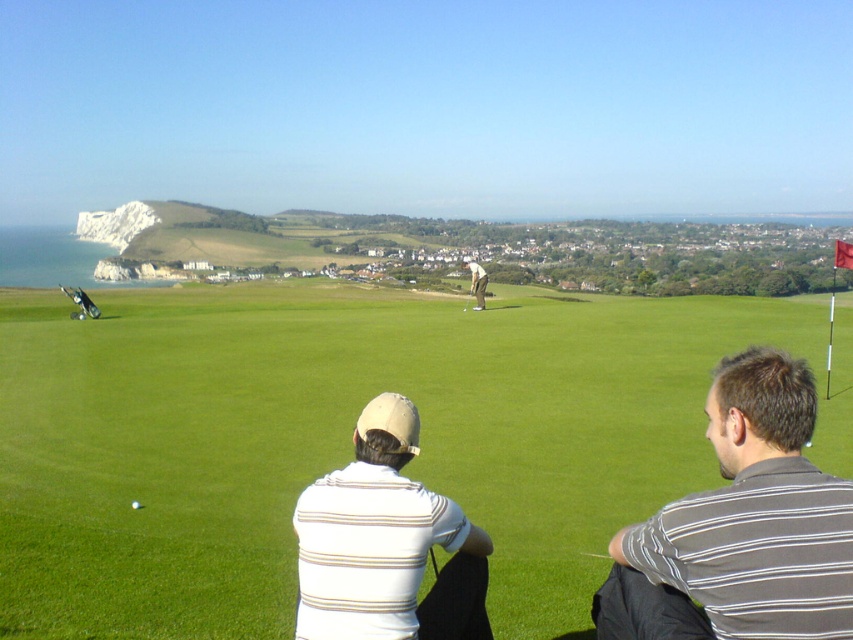
Question: Does white striped shirt at lower center have a lesser width compared to metallic silver golf club at center?

Choices:
 (A) yes
 (B) no

Answer: (B)

Question: Is white striped shirt at lower center bigger than white matte golf ball at center?

Choices:
 (A) yes
 (B) no

Answer: (A)

Question: Which point is closer to the camera taking this photo?

Choices:
 (A) (471, 296)
 (B) (137, 506)

Answer: (B)

Question: Among these points, which one is farthest from the camera?

Choices:
 (A) (138, 508)
 (B) (335, 556)
 (C) (466, 262)

Answer: (C)

Question: Which of these objects is positioned farthest from the green fabric pants at center?

Choices:
 (A) white striped shirt at lower center
 (B) metallic silver golf club at center
 (C) white matte golf ball at center

Answer: (C)

Question: Is white striped shirt at lower center closer to the viewer compared to metallic silver golf club at center?

Choices:
 (A) yes
 (B) no

Answer: (A)